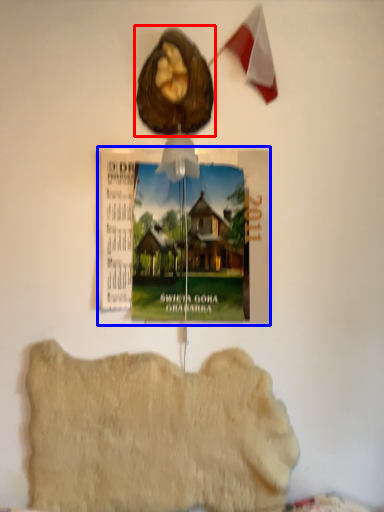
Question: Among these objects, which one is nearest to the camera, animal (highlighted by a red box) or postcard (highlighted by a blue box)?

Choices:
 (A) animal
 (B) postcard

Answer: (A)